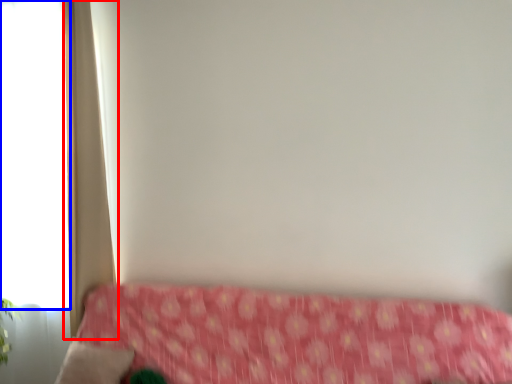
Question: Among these objects, which one is farthest to the camera, curtain (highlighted by a red box) or window (highlighted by a blue box)?

Choices:
 (A) curtain
 (B) window

Answer: (B)